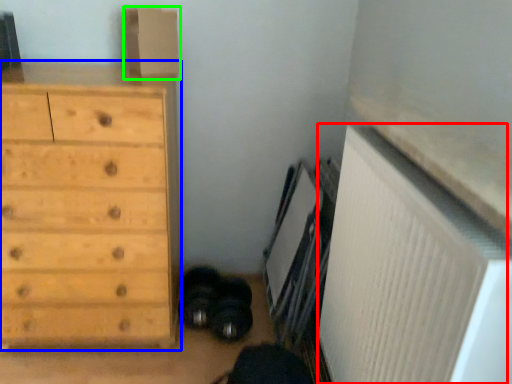
Question: Which object is the closest to the radiator (highlighted by a red box)? Choose among these: chest of drawers (highlighted by a blue box) or cardboard box (highlighted by a green box).

Choices:
 (A) chest of drawers
 (B) cardboard box

Answer: (A)